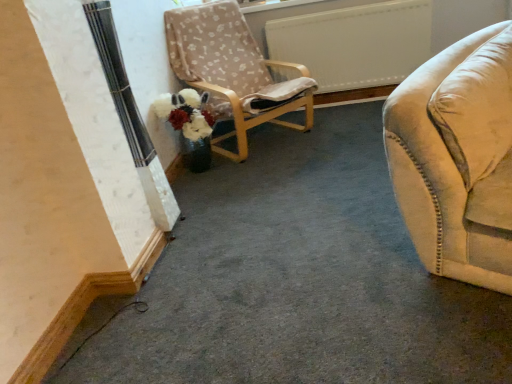
Question: Is beige fabric chair at center taller or shorter than white fluffy flower at center?

Choices:
 (A) tall
 (B) short

Answer: (A)

Question: Is beige fabric chair at center to the left or to the right of white fluffy flower at center in the image?

Choices:
 (A) left
 (B) right

Answer: (B)

Question: Is point (192, 31) positioned closer to the camera than point (209, 114)?

Choices:
 (A) closer
 (B) farther

Answer: (B)

Question: From a real-world perspective, is white fluffy flower at center positioned above or below beige fabric chair at center?

Choices:
 (A) below
 (B) above

Answer: (A)

Question: Is white fluffy flower at center taller or shorter than beige fabric chair at center?

Choices:
 (A) tall
 (B) short

Answer: (B)

Question: Considering their positions, is white fluffy flower at center located in front of or behind beige fabric chair at center?

Choices:
 (A) front
 (B) behind

Answer: (B)

Question: From the image's perspective, relative to beige fabric chair at center, is white fluffy flower at center above or below?

Choices:
 (A) above
 (B) below

Answer: (B)